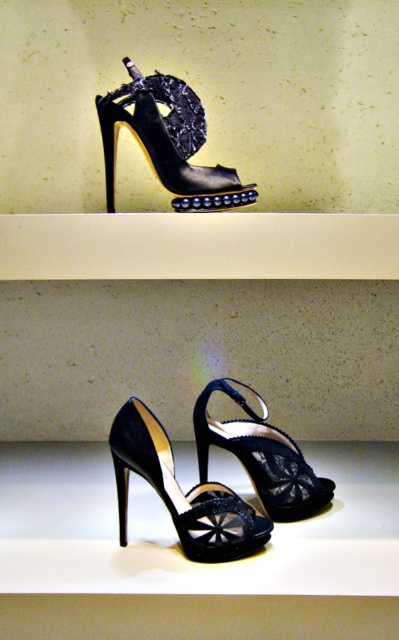
You are organizing a shoe display and need to place the black leather sandal at upper center and the shiny black sandal at center on a shelf. Given their widths, which sandal should be placed first to ensure they both fit on the shelf?

The black leather sandal at upper center has a larger width than the shiny black sandal at center. Therefore, you should place the black leather sandal at upper center first to accommodate its wider size, ensuring both can fit on the shelf.

You are an interior designer arranging items on a shelf. You have a small decorative item that needs to be placed near the point marked at coordinates (167, 141). Which object from the scene should you place it next to?

The point marked at coordinates (167, 141) is on the black leather sandal at upper center, so you should place the decorative item next to the black leather sandal at upper center.